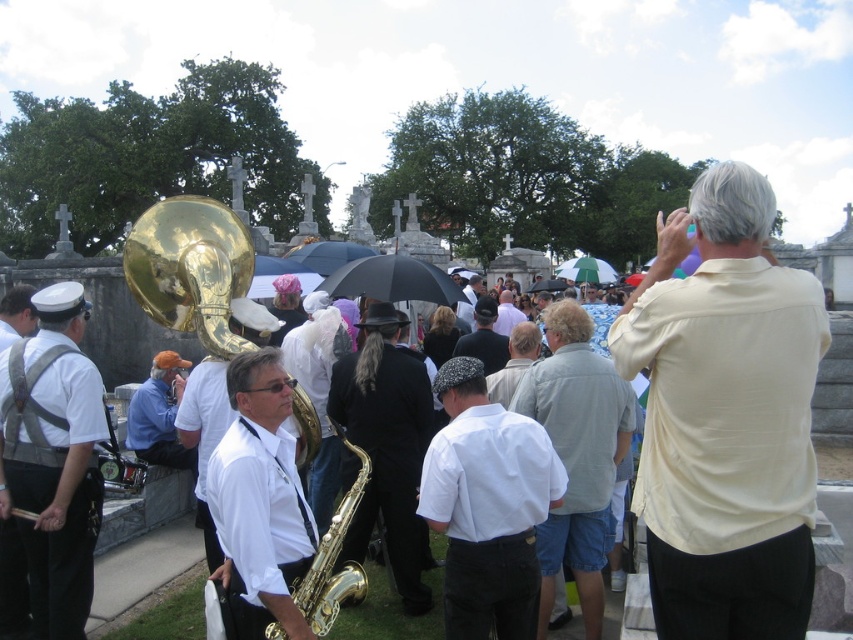
Question: Which of the following is the farthest from the observer?

Choices:
 (A) white uniform at center
 (B) white glossy saxophone at center

Answer: (A)

Question: Does gold shiny saxophone at center have a greater width compared to black matte hat at center?

Choices:
 (A) no
 (B) yes

Answer: (A)

Question: Estimate the real-world distances between objects in this image. Which object is farther from the orange fabric hat at center?

Choices:
 (A) light yellow shirt at upper right
 (B) gold shiny trumpet at center
 (C) white uniform at center
 (D) shiny gold saxophone at center

Answer: (A)

Question: Is white uniform at center positioned at the back of green fabric umbrella at center?

Choices:
 (A) no
 (B) yes

Answer: (A)

Question: Based on their relative distances, which object is farther from the light gray cotton shirt at center?

Choices:
 (A) black matte hat at center
 (B) green fabric umbrella at center
 (C) gold shiny trumpet at center

Answer: (B)

Question: Does white uniform at center appear under black matte hat at center?

Choices:
 (A) yes
 (B) no

Answer: (A)